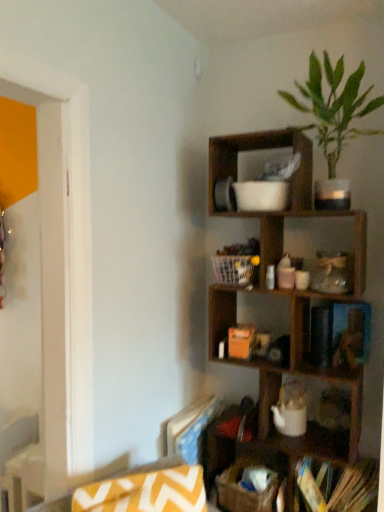
Question: From a real-world perspective, is white plastic basket at center positioned under wooden shelf at upper right based on gravity?

Choices:
 (A) no
 (B) yes

Answer: (A)

Question: From the image's perspective, is white plastic basket at center below wooden shelf at upper right?

Choices:
 (A) no
 (B) yes

Answer: (A)

Question: Is white plastic basket at center smaller than wooden shelf at upper right?

Choices:
 (A) no
 (B) yes

Answer: (B)

Question: Could you tell me if white plastic basket at center is facing wooden shelf at upper right?

Choices:
 (A) yes
 (B) no

Answer: (A)

Question: Is wooden shelf at upper right a part of white plastic basket at center?

Choices:
 (A) yes
 (B) no

Answer: (B)

Question: Considering the positions of hardcover books at lower right and brown woven basket at lower center in the image, is hardcover books at lower right bigger or smaller than brown woven basket at lower center?

Choices:
 (A) big
 (B) small

Answer: (A)

Question: From a real-world perspective, is hardcover books at lower right physically located above or below brown woven basket at lower center?

Choices:
 (A) below
 (B) above

Answer: (A)

Question: Is point (370, 467) positioned closer to the camera than point (271, 507)?

Choices:
 (A) farther
 (B) closer

Answer: (A)

Question: Is hardcover books at lower right to the left or to the right of brown woven basket at lower center in the image?

Choices:
 (A) left
 (B) right

Answer: (B)

Question: Is brown woven basket at lower center spatially inside yellow zigzag fabric swivel chair at lower left, or outside of it?

Choices:
 (A) outside
 (B) inside

Answer: (A)

Question: Considering the positions of brown woven basket at lower center and yellow zigzag fabric swivel chair at lower left in the image, is brown woven basket at lower center bigger or smaller than yellow zigzag fabric swivel chair at lower left?

Choices:
 (A) small
 (B) big

Answer: (A)

Question: Does point (253, 498) appear closer or farther from the camera than point (129, 500)?

Choices:
 (A) farther
 (B) closer

Answer: (A)

Question: Would you say brown woven basket at lower center is to the left or to the right of yellow zigzag fabric swivel chair at lower left in the picture?

Choices:
 (A) left
 (B) right

Answer: (B)

Question: Considering the positions of brown woven basket at lower center and green leafy plant at upper right in the image, is brown woven basket at lower center bigger or smaller than green leafy plant at upper right?

Choices:
 (A) big
 (B) small

Answer: (B)

Question: In terms of height, does brown woven basket at lower center look taller or shorter compared to green leafy plant at upper right?

Choices:
 (A) tall
 (B) short

Answer: (B)